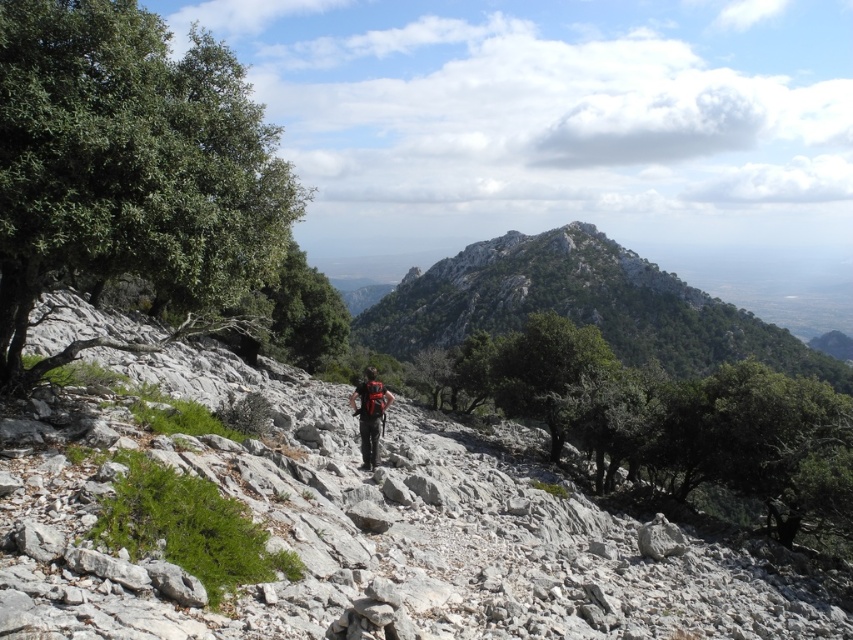
You are a hiker planning to traverse the trail shown in the image. You need to know if you can safely walk from the green rocky mountain at center to the matte black backpack at center without any obstacles. Based on the scene description, can you confirm if the path is clear?

The distance between the green rocky mountain at center and the matte black backpack at center is 645.15 feet. However, the scene description mentions scattered gray rocks and patches of green vegetation, including low shrubs and small trees, which may obstruct the path. Therefore, the path might not be entirely clear of obstacles.

You are a hiker navigating the rugged mountain trail. You notice a specific point marked on your map at coordinates (581, 307). Based on the scene description, what geographical feature does this point most likely represent?

The point at coordinates (581, 307) corresponds to the green rocky mountain at center, as indicated by the objects description.

You are a hiker planning to take a photo of the green leafy tree at left and the green rocky mountain at center. Which object should you zoom in on to capture both in the frame without moving your camera position?

You should zoom in on the green leafy tree at left because it has a lesser width compared to the green rocky mountain at center, so capturing both would require focusing on the narrower object first.